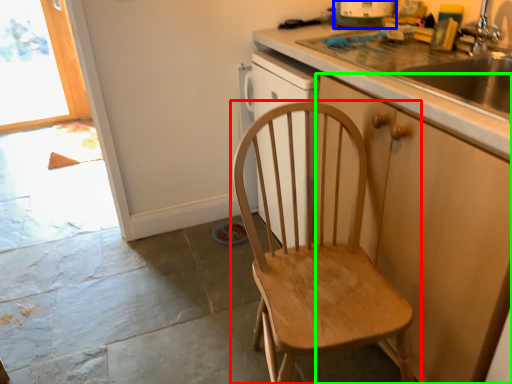
Question: Estimate the real-world distances between objects in this image. Which object is farther from chair (highlighted by a red box), kitchen appliance (highlighted by a blue box) or cabinetry (highlighted by a green box)?

Choices:
 (A) kitchen appliance
 (B) cabinetry

Answer: (A)